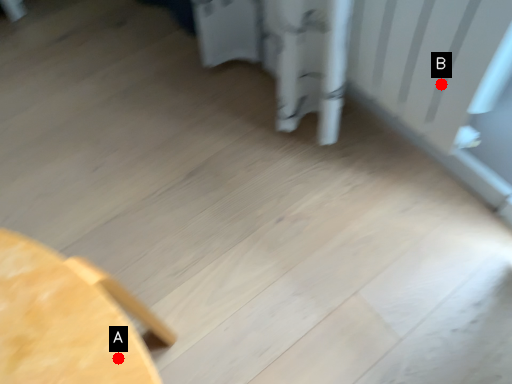
Question: Two points are circled on the image, labeled by A and B beside each circle. Which point is farther to the camera?

Choices:
 (A) A is further
 (B) B is further

Answer: (B)